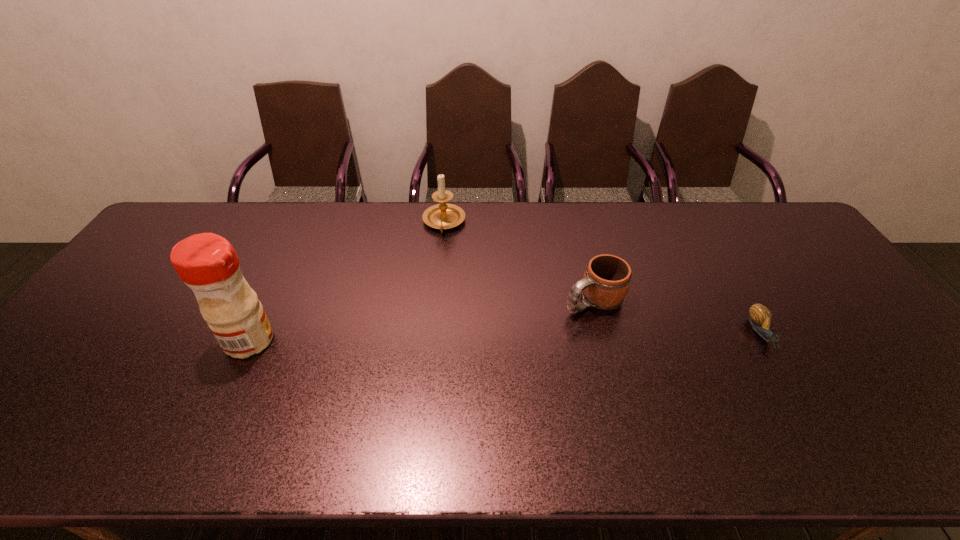
At what (x,y) coordinates should I click in order to perform the action: click on free space that satisfies the following two spatial constraints: 1. on the front side of the second shortest object; 2. on the left side of the second object from left to right. Please return your answer as a coordinate pair (x, y). The image size is (960, 540). Looking at the image, I should click on (437, 300).

I want to click on free point that satisfies the following two spatial constraints: 1. on the back side of the leftmost object; 2. on the right side of the farthest object, so click(x=305, y=222).